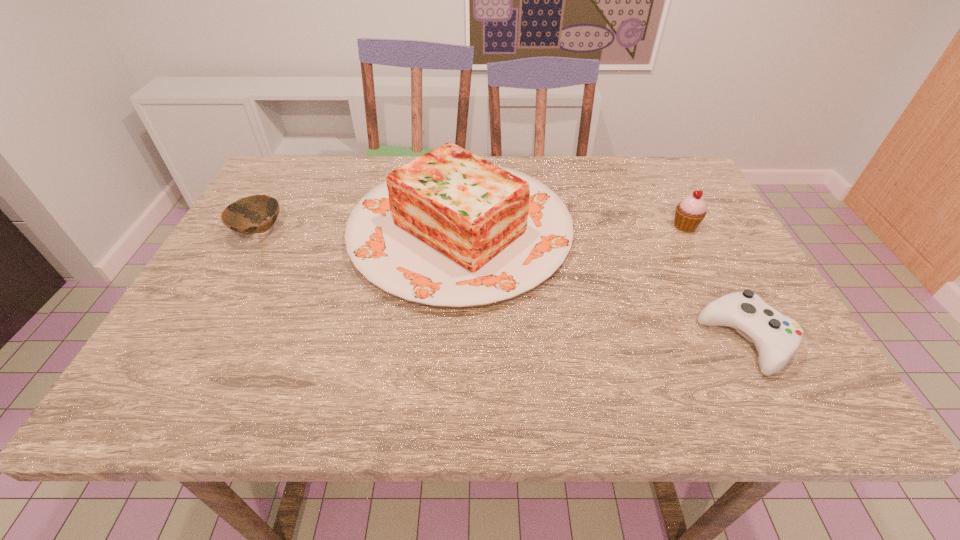
The image size is (960, 540). Find the location of `the third object from right to left`. the third object from right to left is located at coordinates (449, 228).

Where is `the tallest object`? the tallest object is located at coordinates (449, 228).

At what (x,y) coordinates should I click in order to perform the action: click on cupcake. Please return your answer as a coordinate pair (x, y). Looking at the image, I should click on pos(689,213).

What are the coordinates of `bowl` in the screenshot? It's located at (243, 216).

Locate an element on the screen. control is located at coordinates (777, 338).

What are the coordinates of `free location located on the right of the lasagna` in the screenshot? It's located at (660, 231).

The image size is (960, 540). Identify the location of free space located on the back of the cupcake. (664, 187).

At what (x,y) coordinates should I click in order to perform the action: click on free region located 0.320m on the front of the bowl. Please return your answer as a coordinate pair (x, y). Image resolution: width=960 pixels, height=540 pixels. Looking at the image, I should click on (187, 362).

The width and height of the screenshot is (960, 540). I want to click on vacant space located 0.350m on the back of the control, so click(x=676, y=206).

Identify the location of object that is positioned at the far edge. (449, 228).